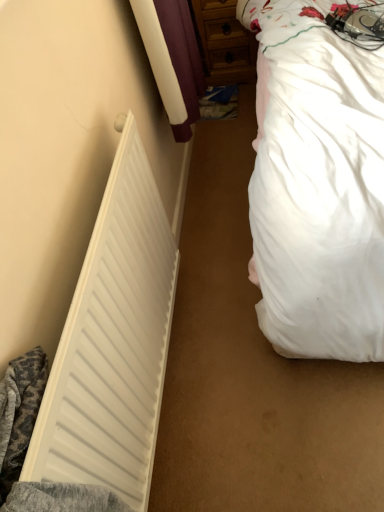
Locate an element on the screen. vacant region under white matte radiator at left (from a real-world perspective) is located at coordinates (171, 369).